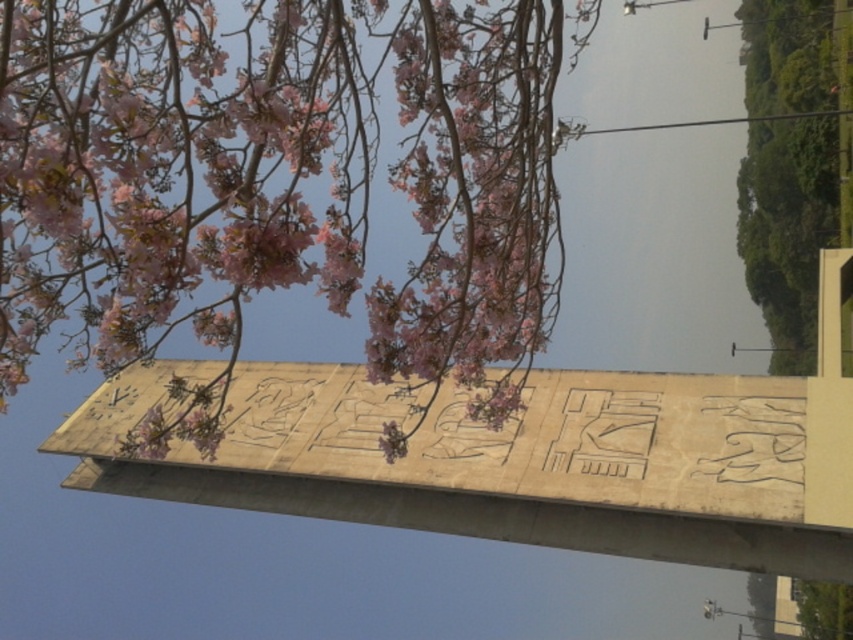
You are an archaeologist standing near the large stone structure. You want to take a photo that includes both the pink matte flowers at upper center and the green leafy tree at upper right. Given their distance apart, can you capture both in a single frame without moving your position?

The pink matte flowers at upper center is 83.11 feet away from the green leafy tree at upper right. Since they are relatively far apart, you may need a wide angle lens to capture both in a single frame without moving your position.

You are standing at a point where you want to take a photo of the large stone structure with ancient Egyptian hieroglyphics. There is a tree with pink blossoms in the foreground that might block your view. You notice a point labeled as point (126, 70) in the scene. If you move 3 meters closer to this point, will the tree still block your view of the stone structure?

Moving 3 meters closer to point (126, 70) would bring you to a distance of 4 meters from it. Since the original distance was 7 meters, reducing it by 3 meters would place you closer, potentially allowing you to see around or over the tree blocking the view. However, the exact visibility depends on the tree height and your adjusted angle, but based on distance reduction alone, the obstruction might decrease.

You are an archaeologist standing at the base of the beige stone obelisk at center. You want to take a photo of the obelisk without any obstructions. Which direction should you move to ensure the tree with pink blossoms doesn not block your view?

The beige stone obelisk at center is located at coordinates point (509, 461). To avoid the tree with pink blossoms obstructing the view, you should move to the right side of the obelisk since the tree is positioned in the foreground on the left side.